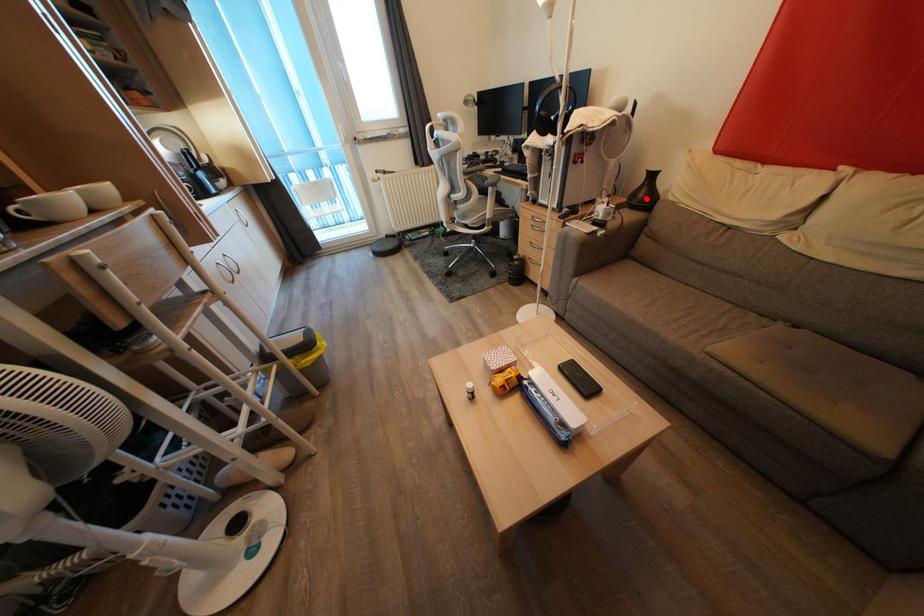
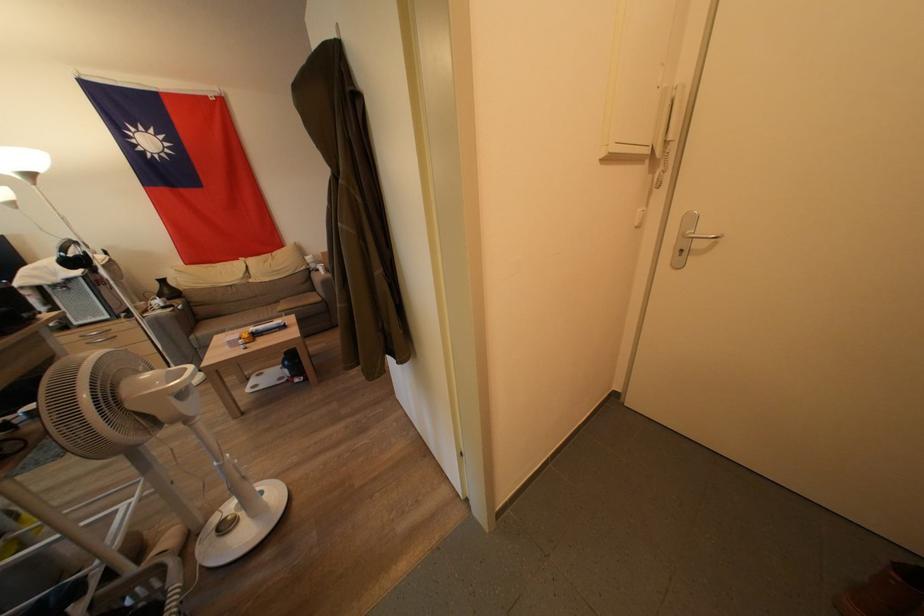
Where in the second image is the point corresponding to the highlighted location from the first image?

(172, 296)